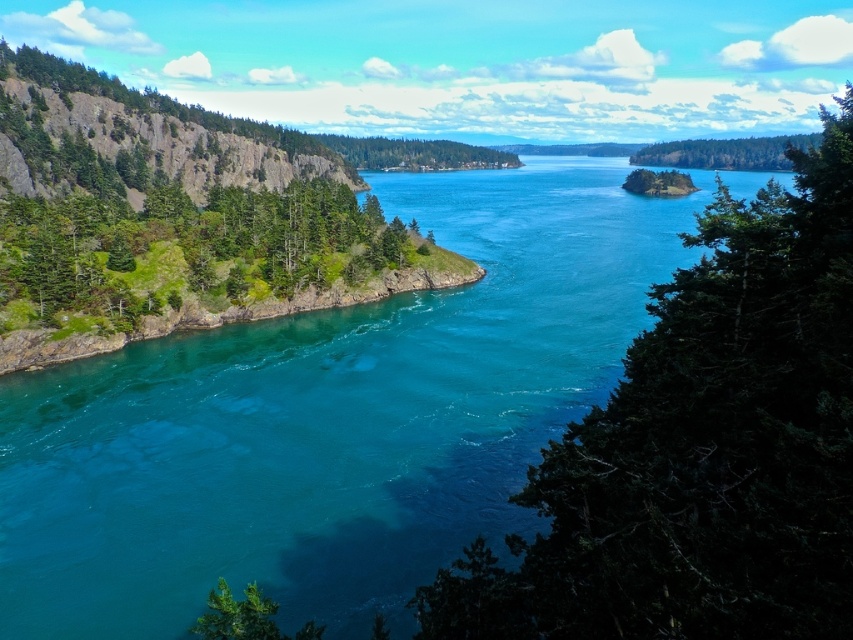
Question: Does green textured tree at center right have a greater width compared to green leafy tree at upper right?

Choices:
 (A) yes
 (B) no

Answer: (B)

Question: Which object appears farthest from the camera in this image?

Choices:
 (A) green textured tree at center right
 (B) green leafy tree at upper right

Answer: (B)

Question: Where is clear blue water at center located in relation to green textured tree at center right in the image?

Choices:
 (A) above
 (B) below

Answer: (A)

Question: Does green textured tree at center right have a larger size compared to green leafy tree at upper right?

Choices:
 (A) no
 (B) yes

Answer: (A)

Question: Which of the following is the closest to the observer?

Choices:
 (A) green textured tree at center right
 (B) green leafy tree at upper right
 (C) clear blue water at center

Answer: (A)

Question: Estimate the real-world distances between objects in this image. Which object is closer to the green leafy tree at upper right?

Choices:
 (A) clear blue water at center
 (B) green textured tree at center right

Answer: (A)